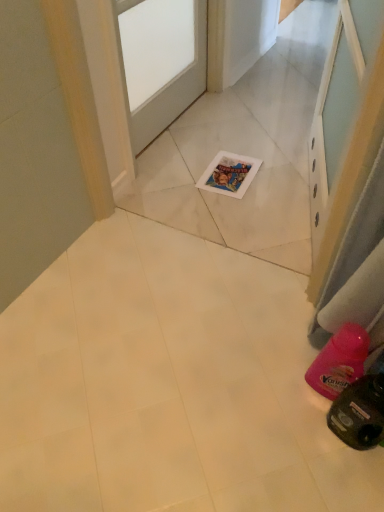
Locate an element on the screen. clear glass screen door at upper center is located at coordinates (333, 116).

This screenshot has height=512, width=384. Describe the element at coordinates (333, 116) in the screenshot. I see `clear glass screen door at upper center` at that location.

From the picture: Measure the distance between clear glass screen door at upper center and camera.

A distance of 3.41 feet exists between clear glass screen door at upper center and camera.

Where is `white matte door at center`? The image size is (384, 512). white matte door at center is located at coordinates (161, 62).

This screenshot has width=384, height=512. What do you see at coordinates (161, 62) in the screenshot?
I see `white matte door at center` at bounding box center [161, 62].

This screenshot has height=512, width=384. Identify the location of clear glass screen door at upper center. (333, 116).

Considering the relative positions of white matte door at center and clear glass screen door at upper center in the image provided, is white matte door at center to the left of clear glass screen door at upper center from the viewer's perspective?

Correct, you'll find white matte door at center to the left of clear glass screen door at upper center.

Which object is more forward, white matte door at center or clear glass screen door at upper center?

clear glass screen door at upper center is in front.

Does point (133, 138) lie behind point (342, 97)?

Yes, it is behind point (342, 97).

From the image's perspective, is white matte door at center positioned above or below clear glass screen door at upper center?

From the image's perspective, white matte door at center appears above clear glass screen door at upper center.

From a real-world perspective, which object rests below the other?

In real-world perspective, white matte door at center is lower.

Which of these two, white matte door at center or clear glass screen door at upper center, is wider?

clear glass screen door at upper center.

Considering the sizes of objects white matte door at center and clear glass screen door at upper center in the image provided, who is shorter, white matte door at center or clear glass screen door at upper center?

→ Standing shorter between the two is white matte door at center.

Considering the sizes of objects white matte door at center and clear glass screen door at upper center in the image provided, who is bigger, white matte door at center or clear glass screen door at upper center?

Bigger between the two is clear glass screen door at upper center.

Which is correct: white matte door at center is inside clear glass screen door at upper center, or outside of it?

white matte door at center exists outside the volume of clear glass screen door at upper center.

Looking at this image, is white matte door at center not near clear glass screen door at upper center?

No, white matte door at center is not far from clear glass screen door at upper center.

Could you tell me if white matte door at center is turned towards clear glass screen door at upper center?

Yes.

What's the angular difference between white matte door at center and clear glass screen door at upper center's facing directions?

162 degrees separate the facing orientations of white matte door at center and clear glass screen door at upper center.

Measure the distance between white matte door at center and clear glass screen door at upper center.

white matte door at center and clear glass screen door at upper center are 29.47 inches apart from each other.

Where is `screen door located below the white matte door at center (from the image's perspective)`? The image size is (384, 512). screen door located below the white matte door at center (from the image's perspective) is located at coordinates (333, 116).

Considering the positions of objects clear glass screen door at upper center and white matte door at center in the image provided, who is more to the left, clear glass screen door at upper center or white matte door at center?

white matte door at center is more to the left.

From the picture: Is clear glass screen door at upper center positioned behind white matte door at center?

No, the depth of clear glass screen door at upper center is less than that of white matte door at center.

Does point (339, 118) come closer to viewer compared to point (119, 32)?

Yes.

From the image's perspective, between clear glass screen door at upper center and white matte door at center, who is located below?

clear glass screen door at upper center.

From a real-world perspective, which object stands above the other?

clear glass screen door at upper center.

Which of these two, clear glass screen door at upper center or white matte door at center, is wider?

clear glass screen door at upper center.

Who is taller, clear glass screen door at upper center or white matte door at center?

clear glass screen door at upper center.

From the picture: Looking at the image, does clear glass screen door at upper center seem bigger or smaller compared to white matte door at center?

clear glass screen door at upper center is bigger than white matte door at center.

Do you think clear glass screen door at upper center is within white matte door at center, or outside of it?

clear glass screen door at upper center is located beyond the bounds of white matte door at center.

Is the surface of clear glass screen door at upper center in direct contact with white matte door at center?

No, clear glass screen door at upper center is not in contact with white matte door at center.

Is clear glass screen door at upper center aimed at white matte door at center?

Yes, clear glass screen door at upper center is facing white matte door at center.

How different are the orientations of clear glass screen door at upper center and white matte door at center in degrees?

There is a 162-degree angle between the facing directions of clear glass screen door at upper center and white matte door at center.

Where is `door on the left of the clear glass screen door at upper center`? The height and width of the screenshot is (512, 384). door on the left of the clear glass screen door at upper center is located at coordinates (161, 62).

Where is `door behind the clear glass screen door at upper center`? door behind the clear glass screen door at upper center is located at coordinates (161, 62).

Where is `screen door on the right of white matte door at center`? screen door on the right of white matte door at center is located at coordinates (333, 116).